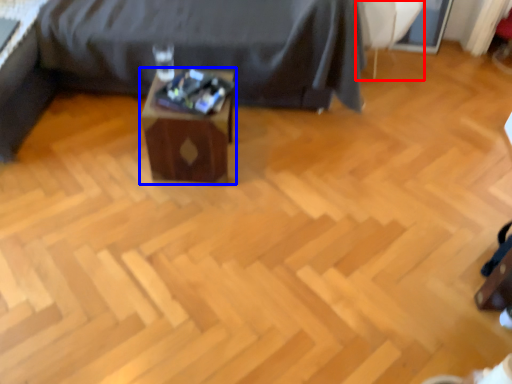
Question: Among these objects, which one is nearest to the camera, swivel chair (highlighted by a red box) or table (highlighted by a blue box)?

Choices:
 (A) swivel chair
 (B) table

Answer: (B)